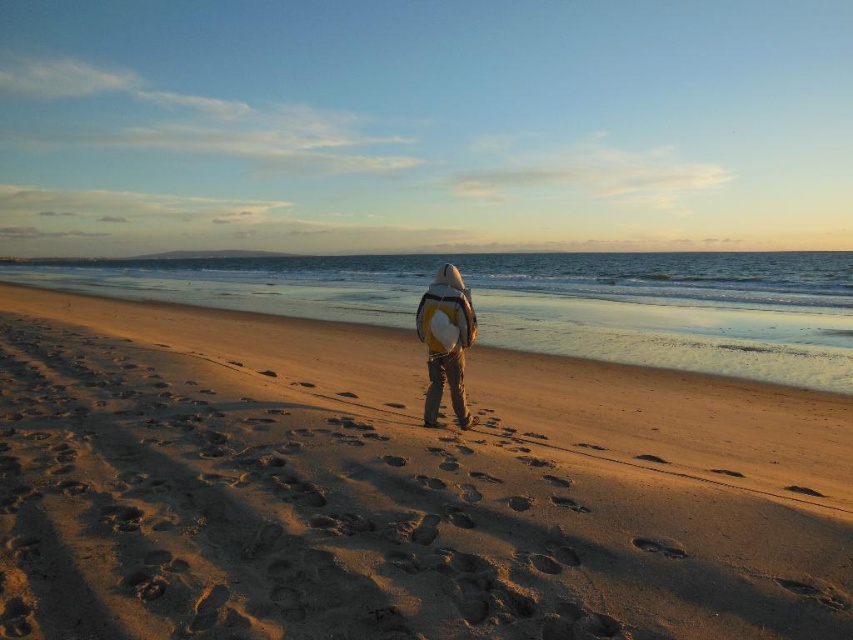
Between point (753, 554) and point (456, 401), which one is positioned in front?

Positioned in front is point (753, 554).

Who is positioned more to the left, sandy beach at center or matte yellow backpack at center?

sandy beach at center

Who is more forward, (318,614) or (444,296)?

Point (318,614) is in front.

I want to click on sandy beach at center, so click(x=397, y=490).